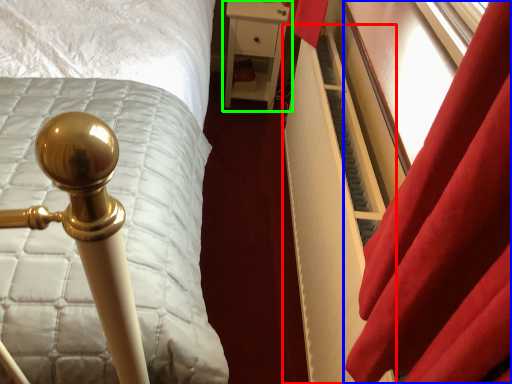
Question: Estimate the real-world distances between objects in this image. Which object is closer to radiator (highlighted by a red box), curtain (highlighted by a blue box) or furniture (highlighted by a green box)?

Choices:
 (A) curtain
 (B) furniture

Answer: (A)